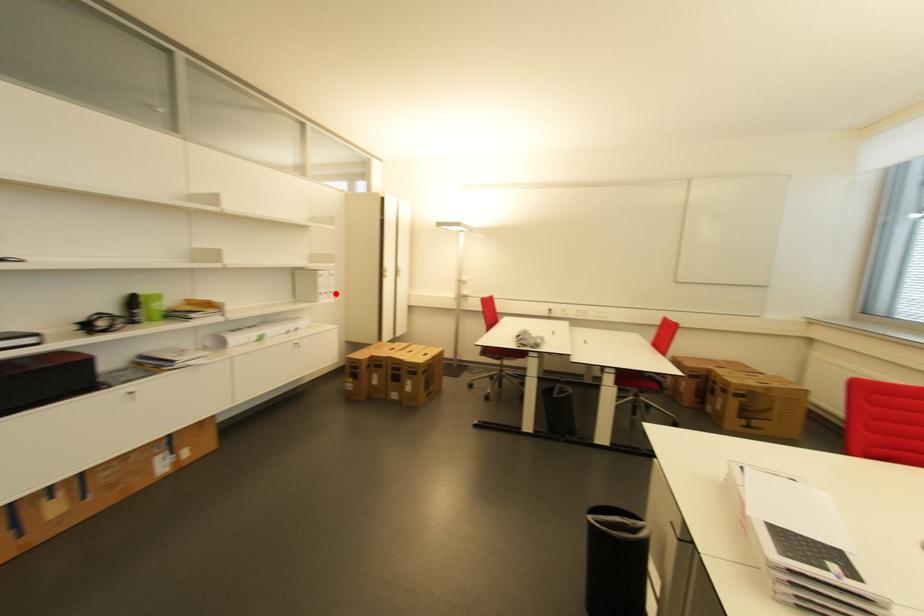
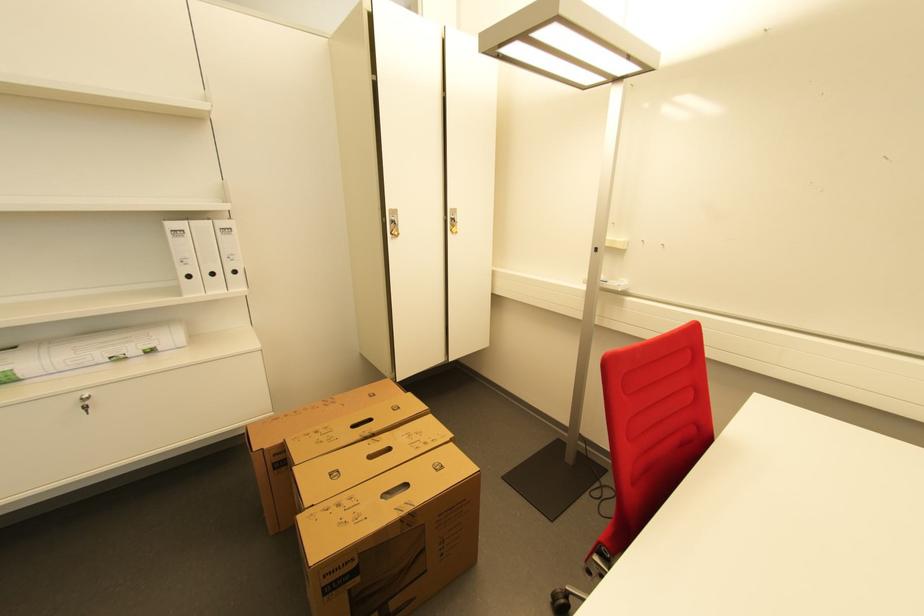
Where in the second image is the point corresponding to the highlighted location from the first image?

(239, 273)